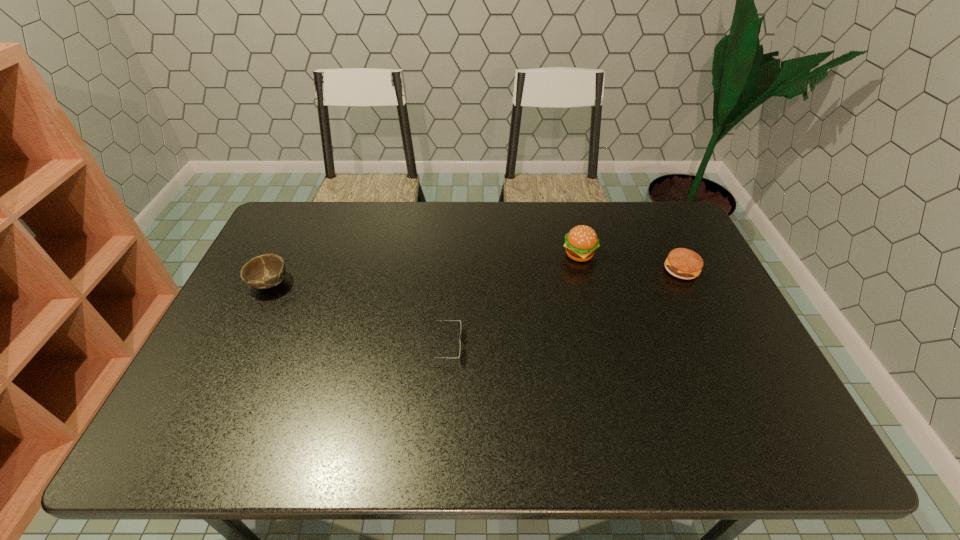
Identify the location of object that stands as the second closest to the leftmost object. Image resolution: width=960 pixels, height=540 pixels. [x=581, y=242].

You are a GUI agent. You are given a task and a screenshot of the screen. Output one action in this format:
    pyautogui.click(x=<x>, y=<y>)
    Task: Click on the free region that satisfies the following two spatial constraints: 1. on the front side of the third object from left to right; 2. on the right side of the shorter hamburger
    
    Given the screenshot: What is the action you would take?
    pyautogui.click(x=584, y=269)

Image resolution: width=960 pixels, height=540 pixels. In order to click on vacant region that satisfies the following two spatial constraints: 1. on the front side of the shorter hamburger; 2. on the front-facing side of the sunglasses in this screenshot , I will do `click(717, 346)`.

The width and height of the screenshot is (960, 540). I want to click on free spot that satisfies the following two spatial constraints: 1. on the front side of the shorter hamburger; 2. on the right side of the taller hamburger, so click(584, 269).

Find the location of a particular element. This screenshot has height=540, width=960. free point that satisfies the following two spatial constraints: 1. on the front side of the right hamburger; 2. on the right side of the left hamburger is located at coordinates (584, 269).

The image size is (960, 540). I want to click on free location that satisfies the following two spatial constraints: 1. on the front side of the taller hamburger; 2. on the front-facing side of the second object from left to right, so (602, 346).

Find the location of `free space that satisfies the following two spatial constraints: 1. on the back side of the third object from left to right; 2. on the left side of the leftmost object`. free space that satisfies the following two spatial constraints: 1. on the back side of the third object from left to right; 2. on the left side of the leftmost object is located at coordinates (284, 254).